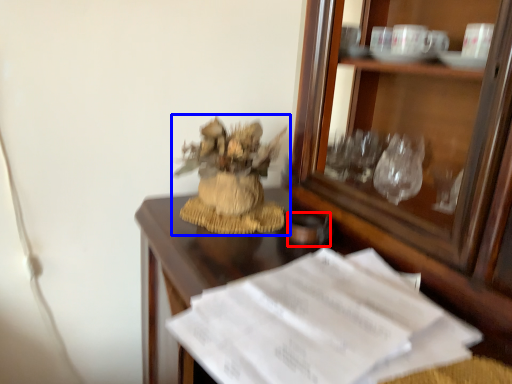
Question: Which object is further to the camera taking this photo, tableware (highlighted by a red box) or houseplant (highlighted by a blue box)?

Choices:
 (A) tableware
 (B) houseplant

Answer: (A)